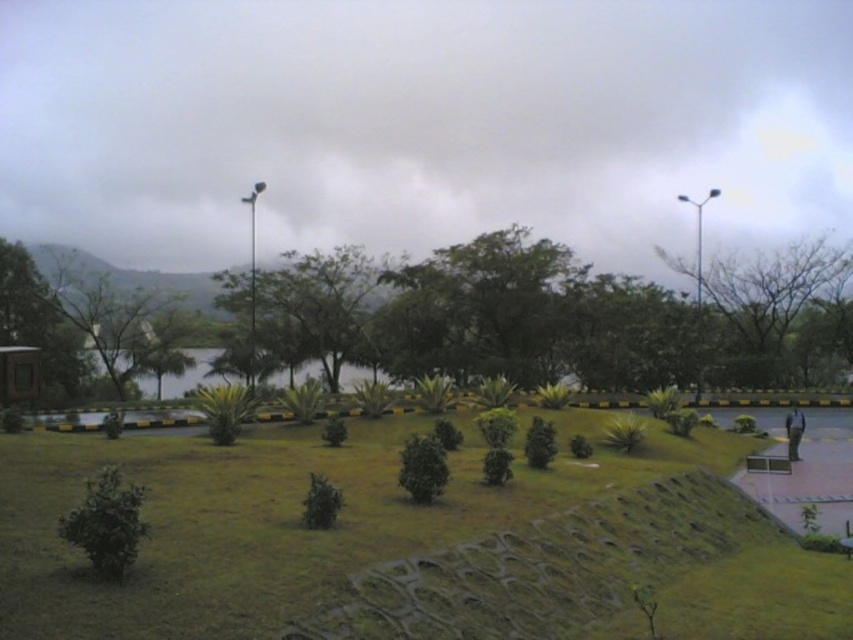
Who is more distant from viewer, (84, 310) or (184, 349)?

The point (184, 349) is more distant.

Does green leafy tree at left appear on the right side of green grassy lake at center?

Incorrect, green leafy tree at left is not on the right side of green grassy lake at center.

Does point (165, 342) come farther from viewer compared to point (357, 372)?

That is False.

You are a GUI agent. You are given a task and a screenshot of the screen. Output one action in this format:
    pyautogui.click(x=<x>, y=<y>)
    Task: Click on the green leafy tree at left
    This screenshot has height=640, width=853.
    Given the screenshot: What is the action you would take?
    pyautogui.click(x=120, y=323)

Consider the image. Is green leafy tree at center shorter than green leafy tree at left?

No, green leafy tree at center is not shorter than green leafy tree at left.

Is point (257, 301) closer to camera compared to point (112, 291)?

No, it is not.

Identify the location of green leafy tree at center. (308, 301).

Is green leafy tree at center positioned before green grassy lake at center?

No, it is behind green grassy lake at center.

Is point (257, 312) less distant than point (189, 388)?

Yes, it is.

Identify the location of green leafy tree at center. This screenshot has height=640, width=853. (308, 301).